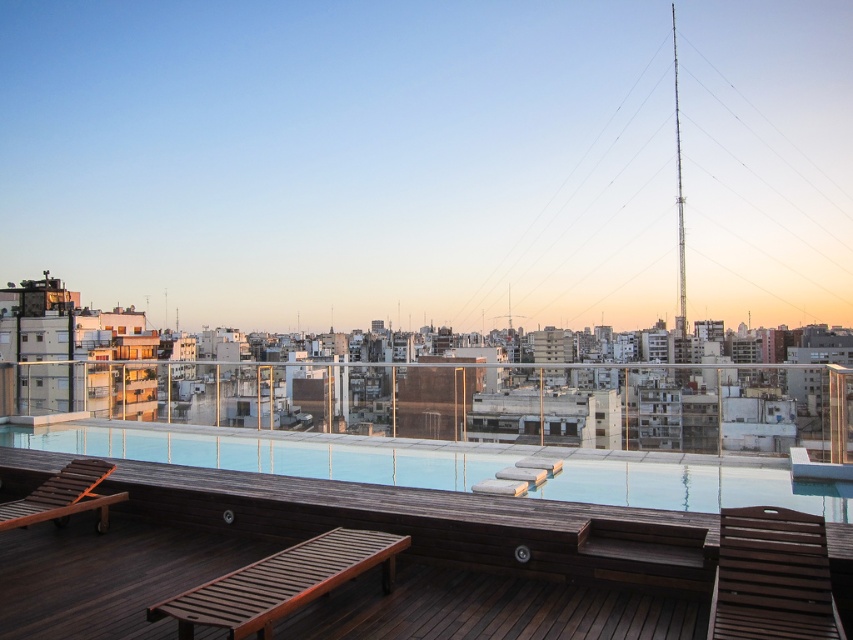
Does brown wooden chair at lower right have a greater width compared to brown wooden lounge chair at lower left?

No, brown wooden chair at lower right is not wider than brown wooden lounge chair at lower left.

In the scene shown: Can you confirm if brown wooden chair at lower right is taller than brown wooden lounge chair at lower left?

In fact, brown wooden chair at lower right may be shorter than brown wooden lounge chair at lower left.

Is point (737, 552) positioned after point (9, 509)?

No.

This screenshot has height=640, width=853. Identify the location of brown wooden chair at lower right. (772, 577).

Does smooth wooden deck at lower center have a lesser height compared to wooden slatted daybed at lower center?

Yes, smooth wooden deck at lower center is shorter than wooden slatted daybed at lower center.

Between smooth wooden deck at lower center and wooden slatted daybed at lower center, which one appears on the left side from the viewer's perspective?

smooth wooden deck at lower center is more to the left.

Image resolution: width=853 pixels, height=640 pixels. Describe the element at coordinates (270, 454) in the screenshot. I see `smooth wooden deck at lower center` at that location.

At what (x,y) coordinates should I click in order to perform the action: click on smooth wooden deck at lower center. Please return your answer as a coordinate pair (x, y). This screenshot has height=640, width=853. Looking at the image, I should click on (270, 454).

Can you confirm if brown wooden chair at lower right is wider than smooth gray lounge chair at center?

Correct, the width of brown wooden chair at lower right exceeds that of smooth gray lounge chair at center.

Is point (755, 637) farther from viewer compared to point (520, 490)?

No, it is in front of (520, 490).

Who is more forward, (802, 538) or (524, 486)?

Point (802, 538) is more forward.

The width and height of the screenshot is (853, 640). I want to click on brown wooden chair at lower right, so click(772, 577).